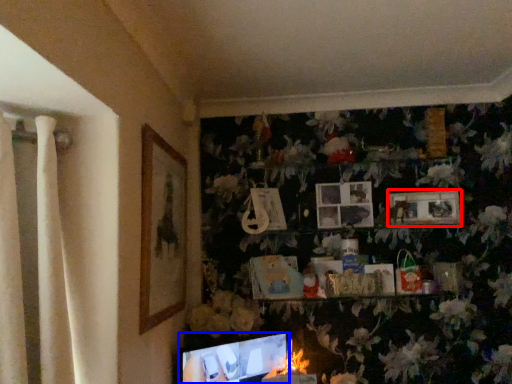
Question: Which object is closer to the camera taking this photo, picture frame (highlighted by a red box) or computer monitor (highlighted by a blue box)?

Choices:
 (A) picture frame
 (B) computer monitor

Answer: (B)